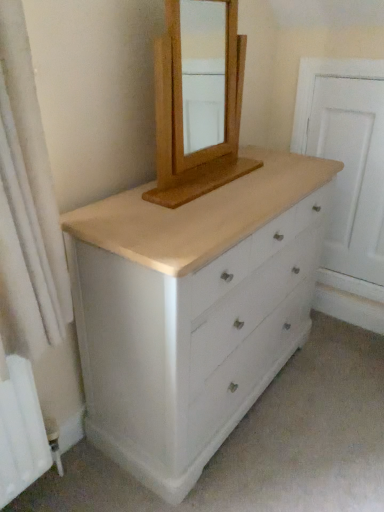
Question: Can you confirm if natural wood mirror at upper center is thinner than white wood screen door at right?

Choices:
 (A) yes
 (B) no

Answer: (B)

Question: Can you confirm if natural wood mirror at upper center is smaller than white wood screen door at right?

Choices:
 (A) yes
 (B) no

Answer: (B)

Question: Is natural wood mirror at upper center looking in the opposite direction of white wood screen door at right?

Choices:
 (A) yes
 (B) no

Answer: (B)

Question: Does natural wood mirror at upper center have a larger size compared to white wood screen door at right?

Choices:
 (A) no
 (B) yes

Answer: (B)

Question: Is natural wood mirror at upper center not close to white wood screen door at right?

Choices:
 (A) no
 (B) yes

Answer: (A)

Question: Is natural wood mirror at upper center in front of white wood screen door at right?

Choices:
 (A) yes
 (B) no

Answer: (A)

Question: Can you confirm if natural wood mirror at upper center is bigger than white painted wood chest of drawers at center?

Choices:
 (A) yes
 (B) no

Answer: (B)

Question: Can you confirm if natural wood mirror at upper center is taller than white painted wood chest of drawers at center?

Choices:
 (A) yes
 (B) no

Answer: (B)

Question: Is natural wood mirror at upper center behind white painted wood chest of drawers at center?

Choices:
 (A) no
 (B) yes

Answer: (B)

Question: Is natural wood mirror at upper center oriented towards white painted wood chest of drawers at center?

Choices:
 (A) no
 (B) yes

Answer: (A)

Question: Does natural wood mirror at upper center have a smaller size compared to white painted wood chest of drawers at center?

Choices:
 (A) no
 (B) yes

Answer: (B)

Question: Is natural wood mirror at upper center not near white painted wood chest of drawers at center?

Choices:
 (A) yes
 (B) no

Answer: (B)

Question: From the image's perspective, does white painted wood chest of drawers at center appear lower than white wood screen door at right?

Choices:
 (A) yes
 (B) no

Answer: (A)